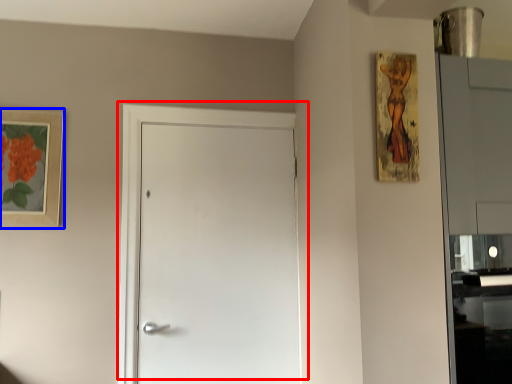
Question: Which point is closer to the camera, door (highlighted by a red box) or picture frame (highlighted by a blue box)?

Choices:
 (A) door
 (B) picture frame

Answer: (B)